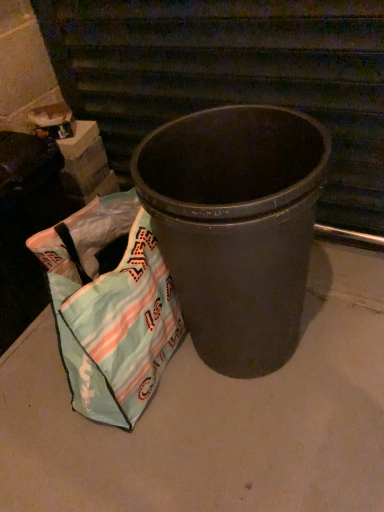
Question: From a real-world perspective, is textured fabric bag at lower left under matte black trash can at center?

Choices:
 (A) yes
 (B) no

Answer: (A)

Question: Does textured fabric bag at lower left have a greater width compared to matte black trash can at center?

Choices:
 (A) yes
 (B) no

Answer: (B)

Question: Is textured fabric bag at lower left bigger than matte black trash can at center?

Choices:
 (A) no
 (B) yes

Answer: (A)

Question: From a real-world perspective, is textured fabric bag at lower left positioned over matte black trash can at center based on gravity?

Choices:
 (A) no
 (B) yes

Answer: (A)

Question: From the image's perspective, does textured fabric bag at lower left appear higher than matte black trash can at center?

Choices:
 (A) no
 (B) yes

Answer: (A)

Question: In terms of height, does textured fabric bag at lower left look taller or shorter compared to matte black trash can at center?

Choices:
 (A) short
 (B) tall

Answer: (A)

Question: Considering the positions of textured fabric bag at lower left and matte black trash can at center in the image, is textured fabric bag at lower left wider or thinner than matte black trash can at center?

Choices:
 (A) wide
 (B) thin

Answer: (B)

Question: Considering the positions of point click(140, 344) and point click(147, 159), is point click(140, 344) closer or farther from the camera than point click(147, 159)?

Choices:
 (A) closer
 (B) farther

Answer: (B)

Question: Considering the positions of textured fabric bag at lower left and matte black trash can at center in the image, is textured fabric bag at lower left bigger or smaller than matte black trash can at center?

Choices:
 (A) big
 (B) small

Answer: (B)

Question: Is point (145, 302) closer or farther from the camera than point (276, 472)?

Choices:
 (A) closer
 (B) farther

Answer: (B)

Question: In terms of size, does textured fabric bag at lower left appear bigger or smaller than matte gray concrete at center?

Choices:
 (A) small
 (B) big

Answer: (A)

Question: Is textured fabric bag at lower left wider or thinner than matte gray concrete at center?

Choices:
 (A) wide
 (B) thin

Answer: (B)

Question: Is textured fabric bag at lower left to the left or to the right of matte gray concrete at center in the image?

Choices:
 (A) right
 (B) left

Answer: (B)

Question: Visually, is matte gray concrete at center positioned to the left or to the right of matte black trash can at center?

Choices:
 (A) left
 (B) right

Answer: (A)

Question: From their relative heights in the image, would you say matte gray concrete at center is taller or shorter than matte black trash can at center?

Choices:
 (A) short
 (B) tall

Answer: (A)